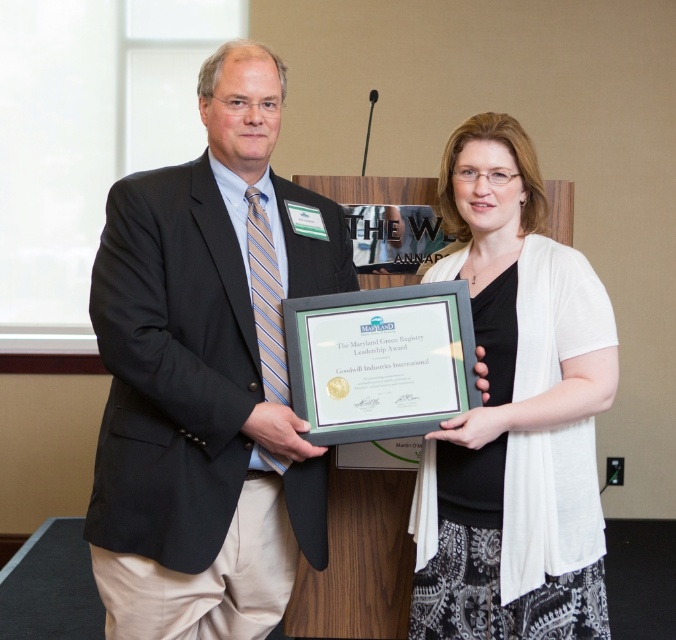
Is point (260, 52) positioned before point (479, 570)?

Yes, point (260, 52) is in front of point (479, 570).

Is matte black suit at center smaller than white textured cardigan at center?

No, matte black suit at center is not smaller than white textured cardigan at center.

This screenshot has width=676, height=640. Describe the element at coordinates (208, 374) in the screenshot. I see `matte black suit at center` at that location.

Where is `matte black suit at center`? matte black suit at center is located at coordinates (208, 374).